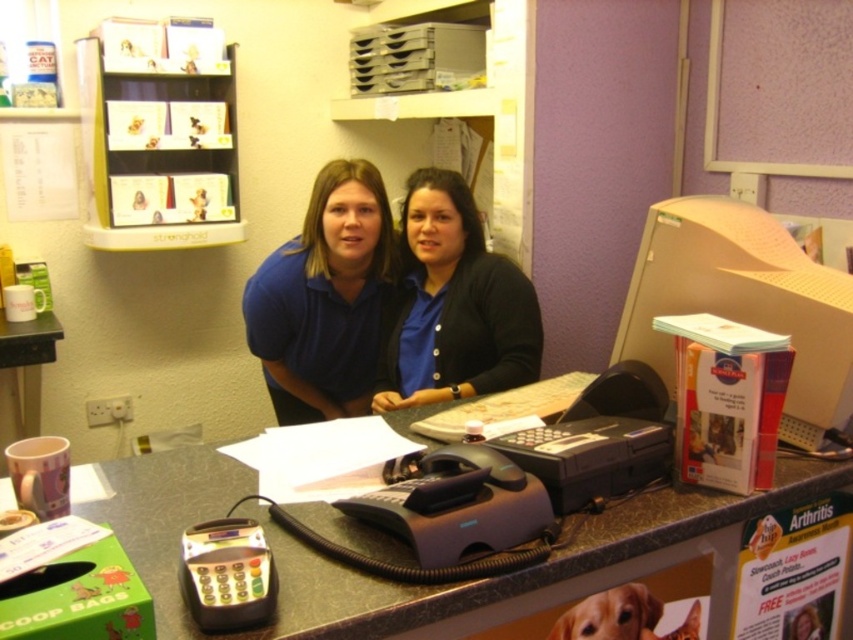
Question: Does marble countertop at center appear on the left side of black matte cardigan at center?

Choices:
 (A) no
 (B) yes

Answer: (A)

Question: Is blue matte shirt at center wider than black matte cardigan at center?

Choices:
 (A) no
 (B) yes

Answer: (B)

Question: Which point appears closest to the camera in this image?

Choices:
 (A) (358, 390)
 (B) (483, 378)
 (C) (165, 513)

Answer: (C)

Question: Is marble countertop at center further to the viewer compared to black matte cardigan at center?

Choices:
 (A) yes
 (B) no

Answer: (B)

Question: Which object appears closest to the camera in this image?

Choices:
 (A) black matte cardigan at center
 (B) marble countertop at center

Answer: (B)

Question: Among these objects, which one is nearest to the camera?

Choices:
 (A) marble countertop at center
 (B) blue matte shirt at center
 (C) black matte cardigan at center

Answer: (A)